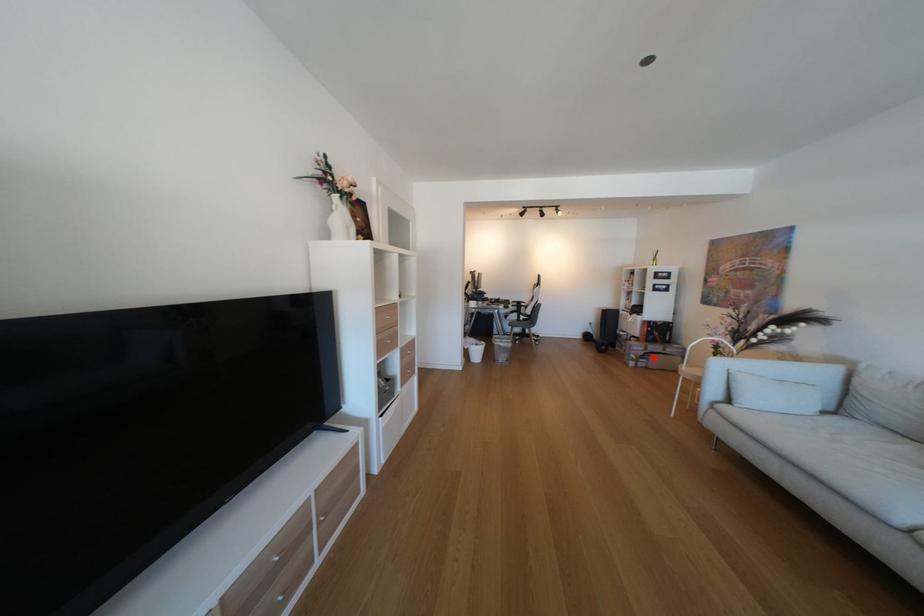
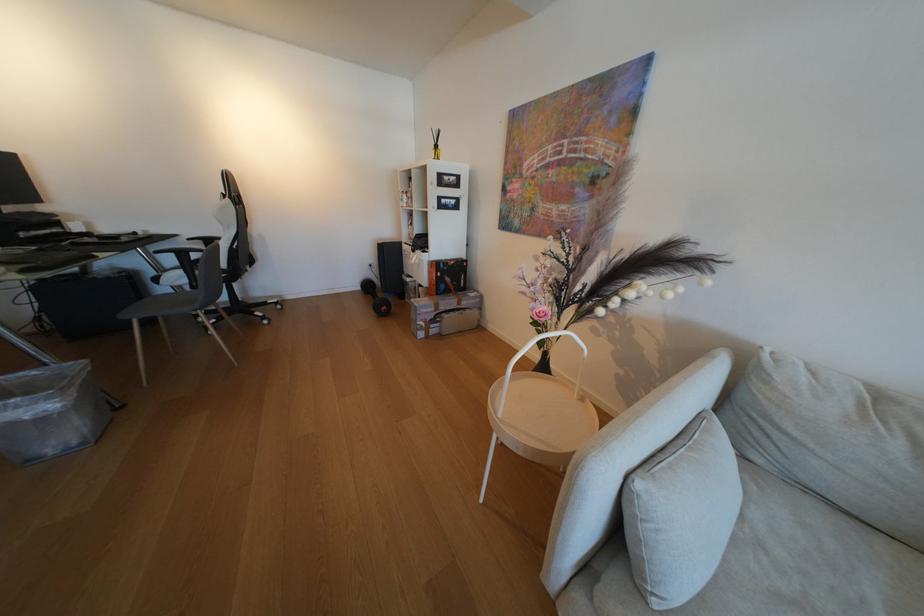
Question: I am providing you with two images of the same scene from different viewpoints. Image1 has a red point marked. In image2, the corresponding 3D location appears at what relative position? Reply with the corresponding letter.

Choices:
 (A) Closer
 (B) Farther

Answer: (B)